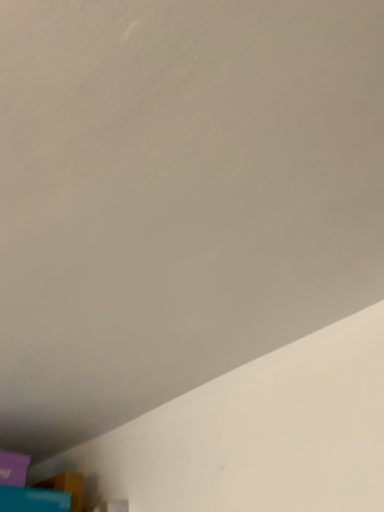
This screenshot has width=384, height=512. Describe the element at coordinates (33, 499) in the screenshot. I see `blue cardboard box at lower left` at that location.

This screenshot has width=384, height=512. I want to click on blue cardboard box at lower left, so click(x=33, y=499).

This screenshot has height=512, width=384. What do you see at coordinates (13, 468) in the screenshot?
I see `purple matte box at lower left` at bounding box center [13, 468].

Locate an element on the screen. This screenshot has width=384, height=512. purple matte box at lower left is located at coordinates (13, 468).

I want to click on blue cardboard box at lower left, so click(x=33, y=499).

Between blue cardboard box at lower left and purple matte box at lower left, which one appears on the left side from the viewer's perspective?

purple matte box at lower left.

Is blue cardboard box at lower left in front of purple matte box at lower left?

Yes.

Is point (28, 501) less distant than point (21, 462)?

That is True.

From the image's perspective, is blue cardboard box at lower left under purple matte box at lower left?

Correct, blue cardboard box at lower left appears lower than purple matte box at lower left in the image.

From a real-world perspective, which object rests below the other?

blue cardboard box at lower left.

Which of these two, blue cardboard box at lower left or purple matte box at lower left, is thinner?

With smaller width is purple matte box at lower left.

Is blue cardboard box at lower left shorter than purple matte box at lower left?

Yes.

Based on the photo, considering the relative sizes of blue cardboard box at lower left and purple matte box at lower left in the image provided, is blue cardboard box at lower left smaller than purple matte box at lower left?

No, blue cardboard box at lower left is not smaller than purple matte box at lower left.

Can we say blue cardboard box at lower left lies outside purple matte box at lower left?

Indeed, blue cardboard box at lower left is completely outside purple matte box at lower left.

Is the surface of blue cardboard box at lower left in direct contact with purple matte box at lower left?

Yes, blue cardboard box at lower left is next to purple matte box at lower left.

Is blue cardboard box at lower left oriented away from purple matte box at lower left?

That's not correct — blue cardboard box at lower left is not looking away from purple matte box at lower left.

Measure the distance between blue cardboard box at lower left and purple matte box at lower left.

3.17 inches.

You are a GUI agent. You are given a task and a screenshot of the screen. Output one action in this format:
    pyautogui.click(x=<x>, y=<y>)
    Task: Click on the wide on the right of purple matte box at lower left
    The width and height of the screenshot is (384, 512).
    Given the screenshot: What is the action you would take?
    pyautogui.click(x=33, y=499)

Can you confirm if purple matte box at lower left is positioned to the right of blue cardboard box at lower left?

No.

Relative to blue cardboard box at lower left, is purple matte box at lower left in front or behind?

purple matte box at lower left is positioned farther from the viewer than blue cardboard box at lower left.

Which is in front, point (17, 463) or point (27, 508)?

The point (27, 508) is in front.

From the image's perspective, who appears lower, purple matte box at lower left or blue cardboard box at lower left?

blue cardboard box at lower left is shown below in the image.

From a real-world perspective, which is physically below, purple matte box at lower left or blue cardboard box at lower left?

blue cardboard box at lower left, from a real-world perspective.

Which of these two, purple matte box at lower left or blue cardboard box at lower left, is thinner?

Thinner between the two is purple matte box at lower left.

Considering the sizes of purple matte box at lower left and blue cardboard box at lower left in the image, is purple matte box at lower left taller or shorter than blue cardboard box at lower left?

Considering their sizes, purple matte box at lower left has more height than blue cardboard box at lower left.

Is purple matte box at lower left bigger or smaller than blue cardboard box at lower left?

purple matte box at lower left is smaller than blue cardboard box at lower left.

In the scene shown: Would you say purple matte box at lower left contains blue cardboard box at lower left?

That's incorrect, blue cardboard box at lower left is not inside purple matte box at lower left.

Does purple matte box at lower left touch blue cardboard box at lower left?

Yes, purple matte box at lower left and blue cardboard box at lower left clearly make contact.

Consider the image. Is purple matte box at lower left oriented away from blue cardboard box at lower left?

No, purple matte box at lower left is not facing away from blue cardboard box at lower left.

Can you tell me how much purple matte box at lower left and blue cardboard box at lower left differ in facing direction?

The facing directions of purple matte box at lower left and blue cardboard box at lower left are 4.71 degrees apart.

Identify the location of box lying above the blue cardboard box at lower left (from the image's perspective). Image resolution: width=384 pixels, height=512 pixels. (13, 468).

Locate an element on the screen. The image size is (384, 512). wide below the purple matte box at lower left (from the image's perspective) is located at coordinates pos(33,499).

At what (x,y) coordinates should I click in order to perform the action: click on box on the left of the blue cardboard box at lower left. Please return your answer as a coordinate pair (x, y). Looking at the image, I should click on (13, 468).